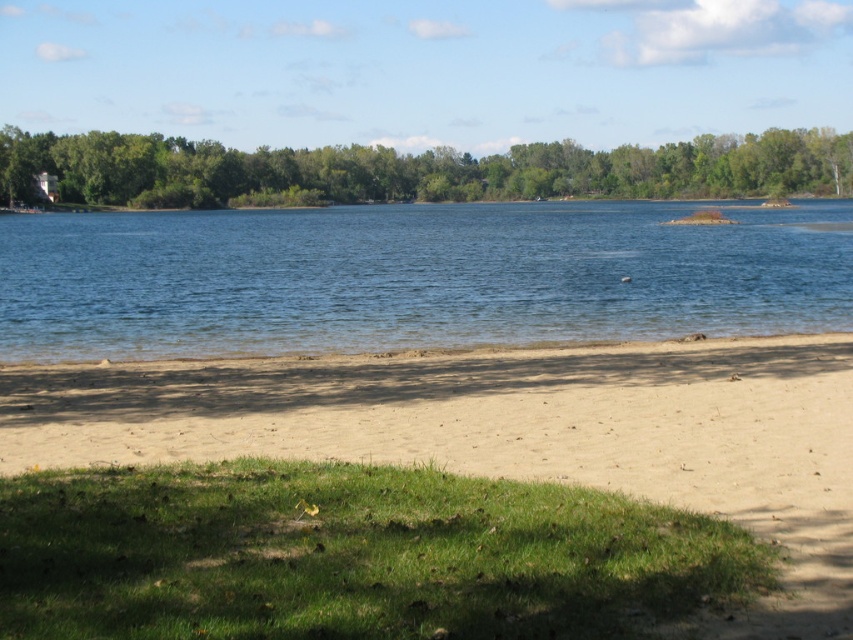
You are standing at the lakeside and want to take a photo of both the light brown sandy beach at lower center and the green leafy tree at upper center. Which object will appear larger in your photo?

The light brown sandy beach at lower center will appear larger in the photo because it is closer to the viewer than the green leafy tree at upper center.